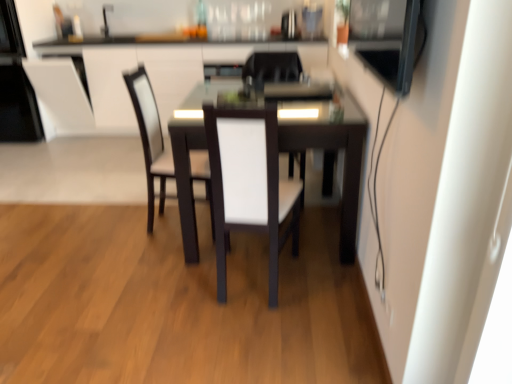
Where is `vacant space in between white fabric chair at center, marked as the first chair in a front-to-back arrangement, and dark wood table at center`? This screenshot has height=384, width=512. vacant space in between white fabric chair at center, marked as the first chair in a front-to-back arrangement, and dark wood table at center is located at coordinates (281, 276).